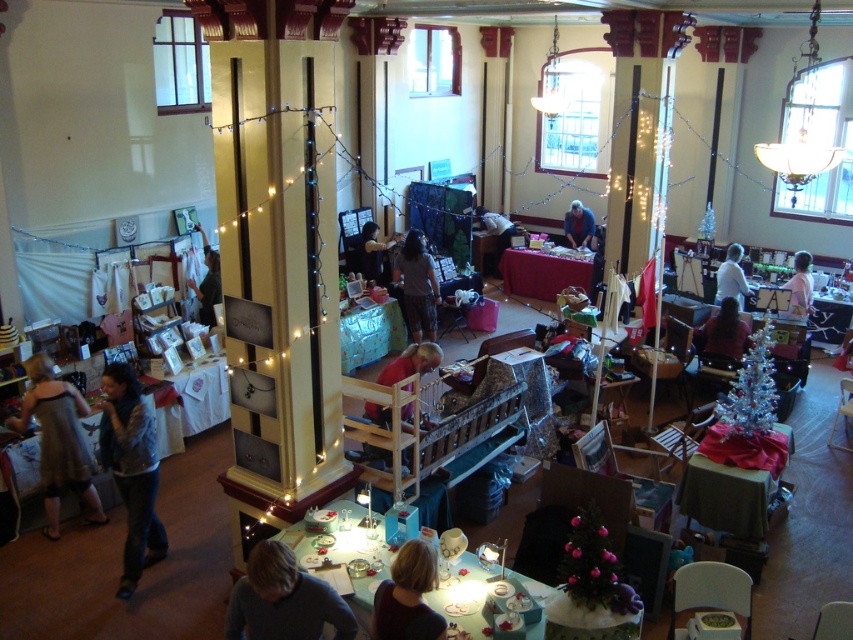
You are standing in the event space and notice two points marked in the image. Which point is closer to you, point (277, 625) or point (424, 609)?

Point (424, 609) is closer to you because it is less further to the camera than point (277, 625).

You are a vendor at the craft fair and you notice two customers, one wearing a dark gray sweater at lower center and another with blonde hair at lower center. Which customer is closer to your stall located at the front of the hall?

The dark gray sweater at lower center is closer to your stall because it is further to the viewer than the blonde hair at lower center, indicating it is nearer in the space.